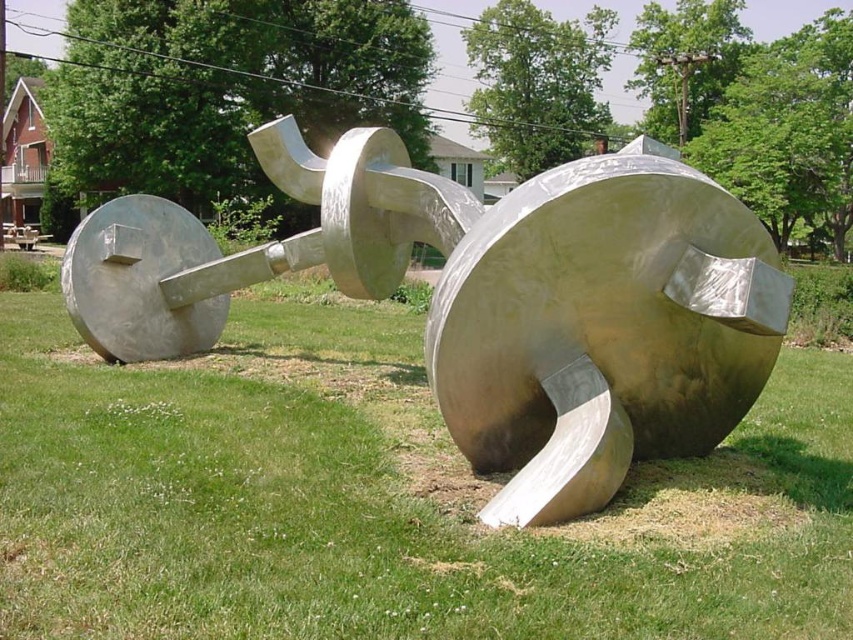
Does point (502, 481) come farther from viewer compared to point (486, 412)?

Yes.

Does green grass at center appear over polished silver sculpture at center?

No, green grass at center is not above polished silver sculpture at center.

Does point (373, 508) come behind point (738, 360)?

No.

At what (x,y) coordinates should I click in order to perform the action: click on green grass at center. Please return your answer as a coordinate pair (x, y). Looking at the image, I should click on (381, 497).